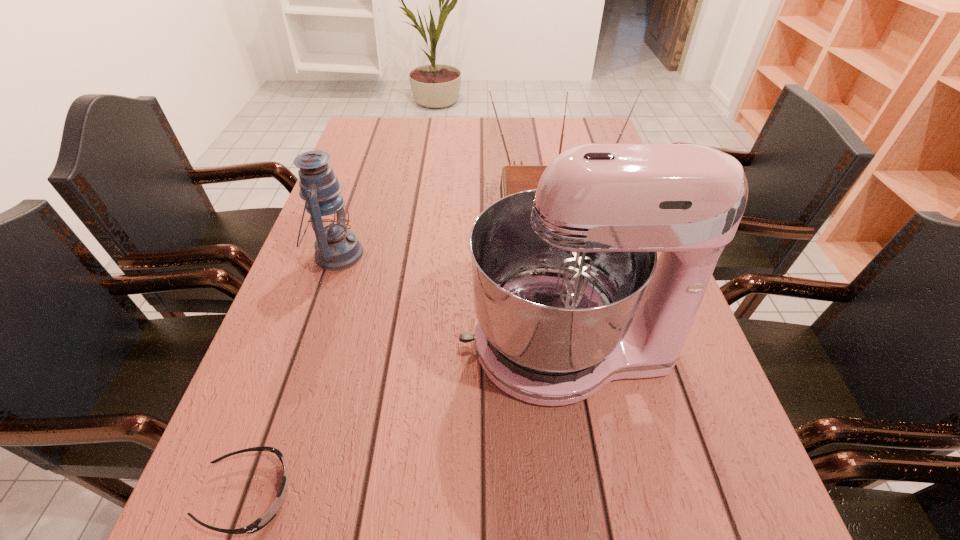
This screenshot has width=960, height=540. In order to click on the tallest object in this screenshot , I will do `click(569, 295)`.

This screenshot has height=540, width=960. I want to click on the second nearest object, so click(569, 295).

Find the location of a particular element. The width and height of the screenshot is (960, 540). radio_receiver is located at coordinates (515, 178).

Locate an element on the screen. The height and width of the screenshot is (540, 960). lantern is located at coordinates (336, 248).

Locate an element on the screen. the nearest object is located at coordinates (260, 523).

Find the location of a particular element. the shortest object is located at coordinates (260, 523).

This screenshot has height=540, width=960. Identify the location of vacant space located on the front-facing side of the tallest object. (403, 345).

Image resolution: width=960 pixels, height=540 pixels. I want to click on vacant space located 0.160m on the front-facing side of the tallest object, so click(378, 345).

Locate an element on the screen. vacant space situated on the front-facing side of the tallest object is located at coordinates (322, 345).

I want to click on free spot located on the front panel of the radio_receiver, so [x=579, y=335].